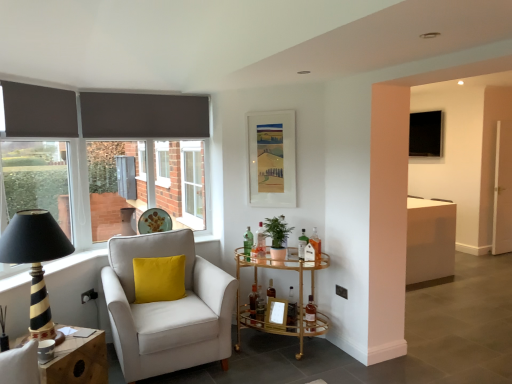
Question: From a real-world perspective, is green glass bottle at center, the fifth bottle in the right-to-left sequence, located higher than white plastic window frame at center?

Choices:
 (A) yes
 (B) no

Answer: (B)

Question: Considering the relative sizes of green glass bottle at center, the fifth bottle in the right-to-left sequence, and white plastic window frame at center in the image provided, is green glass bottle at center, the fifth bottle in the right-to-left sequence, shorter than white plastic window frame at center?

Choices:
 (A) yes
 (B) no

Answer: (A)

Question: Is green glass bottle at center, the fifth bottle in the right-to-left sequence, positioned behind white plastic window frame at center?

Choices:
 (A) yes
 (B) no

Answer: (B)

Question: Is green glass bottle at center, the fifth bottle in the right-to-left sequence, turned away from white plastic window frame at center?

Choices:
 (A) no
 (B) yes

Answer: (A)

Question: Is green glass bottle at center, the 3th bottle when ordered from left to right, with white plastic window frame at center?

Choices:
 (A) no
 (B) yes

Answer: (A)

Question: Considering the positions of black plastic power outlet at lower left, arranged as the 2th power outlet when viewed from the right, and green matte plant at center in the image, is black plastic power outlet at lower left, arranged as the 2th power outlet when viewed from the right, taller or shorter than green matte plant at center?

Choices:
 (A) tall
 (B) short

Answer: (B)

Question: Considering the relative positions of black plastic power outlet at lower left, the first power outlet in the left-to-right sequence, and green matte plant at center in the image provided, is black plastic power outlet at lower left, the first power outlet in the left-to-right sequence, to the left or to the right of green matte plant at center?

Choices:
 (A) right
 (B) left

Answer: (B)

Question: From a real-world perspective, is black plastic power outlet at lower left, the first power outlet in the left-to-right sequence, physically located above or below green matte plant at center?

Choices:
 (A) above
 (B) below

Answer: (B)

Question: Does point (95, 299) appear closer or farther from the camera than point (276, 228)?

Choices:
 (A) farther
 (B) closer

Answer: (A)

Question: In terms of height, does white plastic window frame at center look taller or shorter compared to black striped wood table lamp at left?

Choices:
 (A) short
 (B) tall

Answer: (B)

Question: Is point (200, 218) closer or farther from the camera than point (36, 253)?

Choices:
 (A) farther
 (B) closer

Answer: (A)

Question: In terms of width, does white plastic window frame at center look wider or thinner when compared to black striped wood table lamp at left?

Choices:
 (A) thin
 (B) wide

Answer: (A)

Question: From a real-world perspective, relative to black striped wood table lamp at left, is white plastic window frame at center vertically above or below?

Choices:
 (A) below
 (B) above

Answer: (B)

Question: Which is correct: translucent glass bottle at center, which appears as the second bottle when viewed from the left, is inside gold glass bar cart at center, which is the first table from back to front, or outside of it?

Choices:
 (A) inside
 (B) outside

Answer: (A)

Question: Relative to gold glass bar cart at center, the 2th table positioned from the left, is translucent glass bottle at center, which appears as the second bottle when viewed from the left, in front or behind?

Choices:
 (A) front
 (B) behind

Answer: (B)